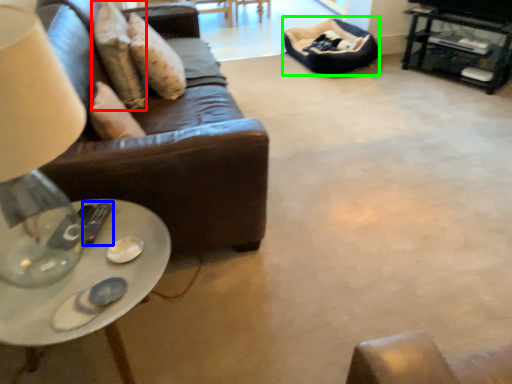
Question: Which object is the farthest from pillow (highlighted by a red box)? Choose among these: remote (highlighted by a blue box) or bean bag chair (highlighted by a green box).

Choices:
 (A) remote
 (B) bean bag chair

Answer: (B)